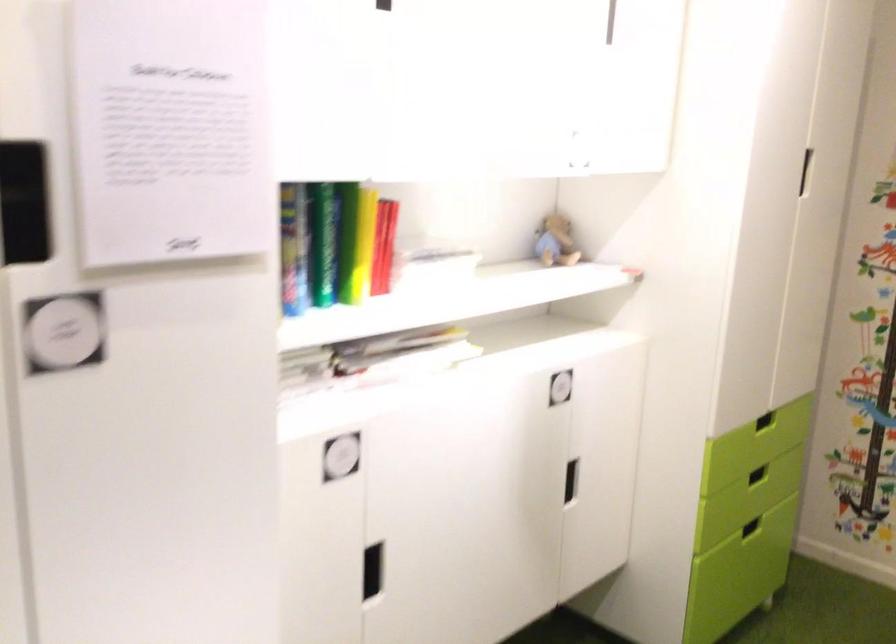
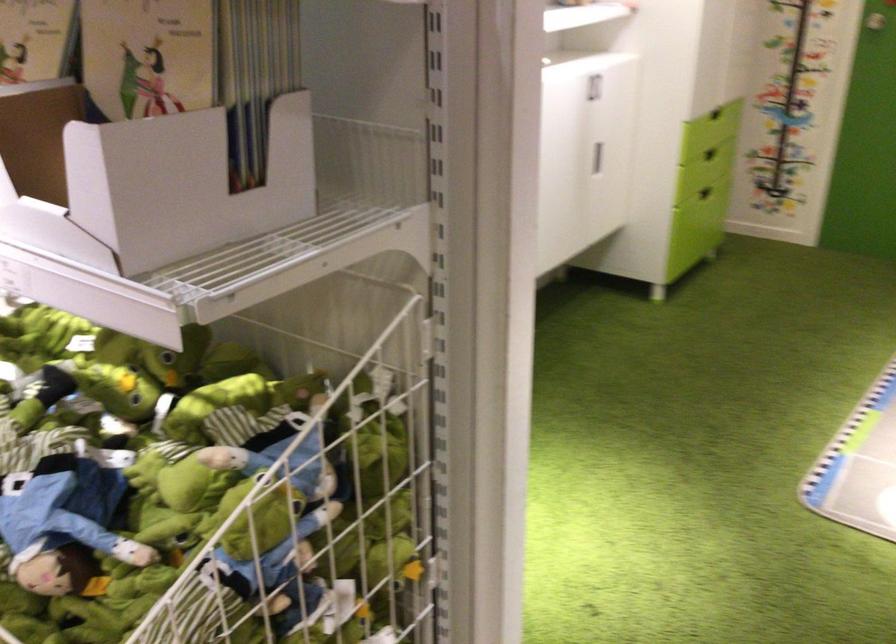
The point at [561,392] is marked in the first image. Where is the corresponding point in the second image?

(593, 87)